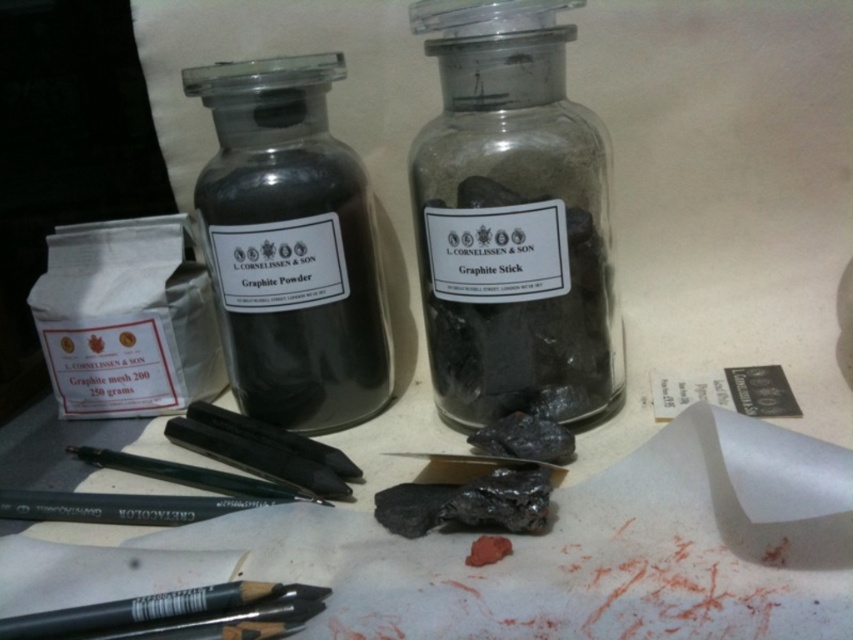
You are an artist trying to reach the matte black pencil at center. There is a transparent glass jar at center blocking your path. Can you move the jar to access the pencil?

The transparent glass jar at center is in front of the matte black pencil at center, so you can move the jar to access the pencil.

You need to store a long thin art tool in your art kit. You have a matte glass bottle at center and a matte black pencil at lower left. Which one can you use to store the tool without bending it?

The matte glass bottle at center is much taller than the matte black pencil at lower left, so the matte glass bottle at center can accommodate the long thin art tool without bending it.

You are an artist trying to choose a pencil for detailed work. You have two options on the desk, the matte black pencil at lower left and the matte black pencil at center. Which pencil should you choose based on their widths?

The matte black pencil at lower left is narrower than the matte black pencil at center. For detailed work, a thinner pencil is better, so choose the matte black pencil at lower left.